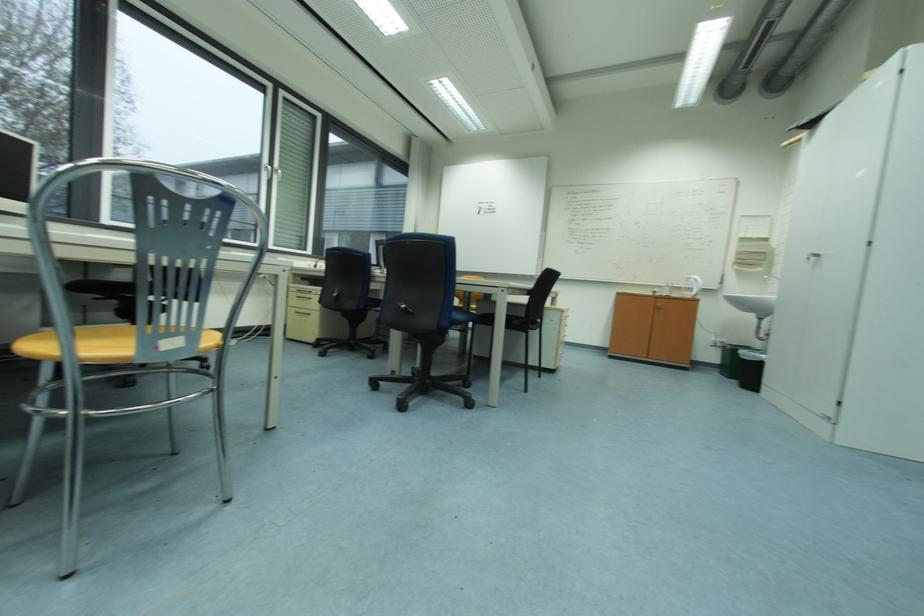
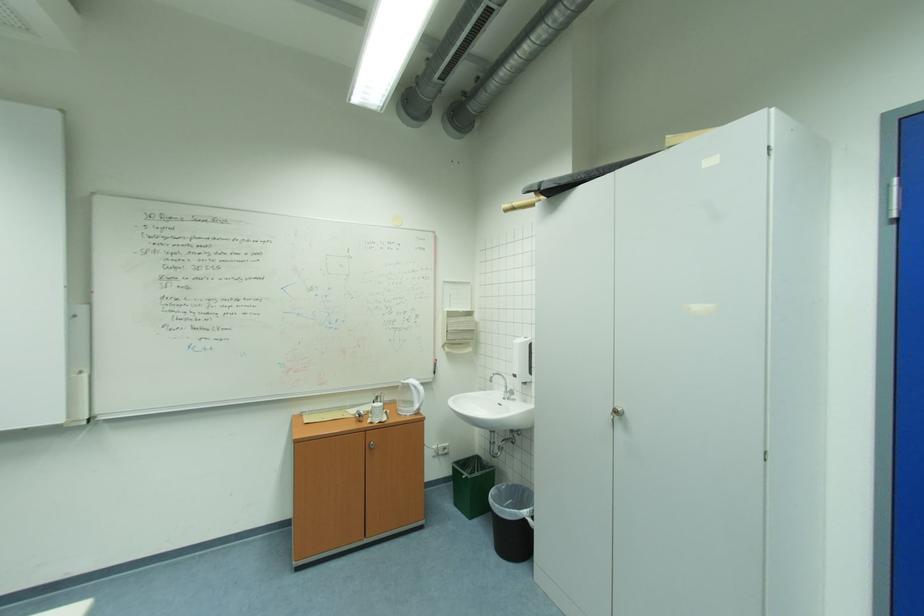
Find the pixel in the second image that matches the point at 696,297 in the first image.

(415, 411)